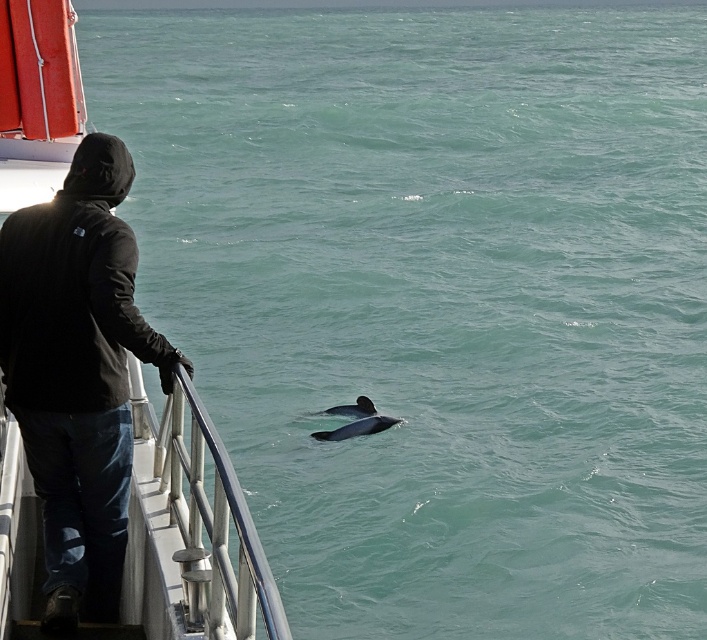
You are a marine biologist on a research boat. You need to throw a food packet to the gray smooth dolphin at center from the metallic boat at left. The packet can travel 4 meters. Will it reach the dolphin?

The metallic boat at left and gray smooth dolphin at center are 4.35 meters apart from each other. Since the packet can only travel 4 meters, it will not reach the dolphin.

You are on a boat and want to locate the metallic boat at left. Where exactly is it positioned in the image?

The metallic boat at left is positioned at coordinates point (x=105, y=371).